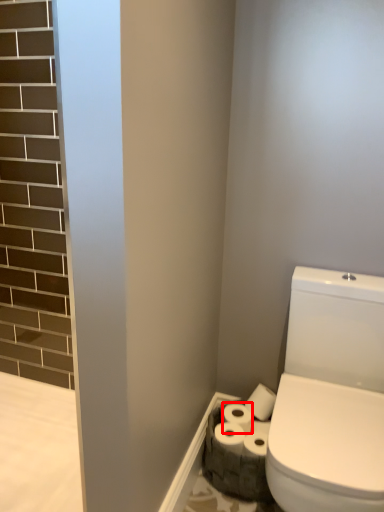
Question: From the image's perspective, what is the correct spatial relationship of toilet paper (annotated by the red box) in relation to toilet paper?

Choices:
 (A) above
 (B) below

Answer: (A)